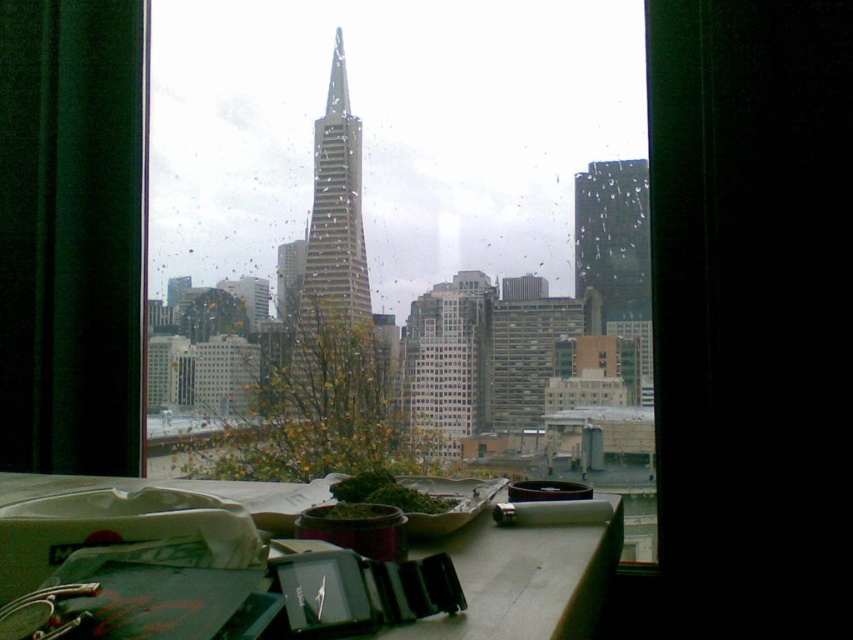
Based on the photo, you are an architect analyzing the cityscape through the window. You need to determine which of the two skyscrapers, the glassy steel skyscraper at center or the glassy reflective skyscraper at right, has a greater width. Based on your observation, which one is wider?

The glassy steel skyscraper at center is wider than the glassy reflective skyscraper at right.

You are standing at the desk and want to take a photo of the glassy steel skyscraper at center through the window. The camera you have can focus on objects up to 100 meters away. Will the camera be able to focus on the skyscraper?

The glassy steel skyscraper at center and camera are 113.17 meters apart. Since the camera can focus up to 100 meters, it cannot focus on the skyscraper as the distance exceeds its maximum range.

You are an architect evaluating the proportions of the transparent glass window at center and the glassy steel skyscraper at center in the image. Which object appears taller in the scene?

The transparent glass window at center appears taller than the glassy steel skyscraper at center in the scene.